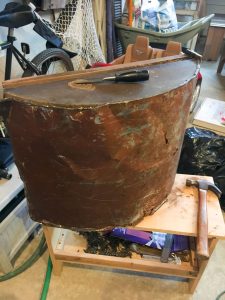
This screenshot has width=225, height=300. I want to click on table leg, so click(220, 68).